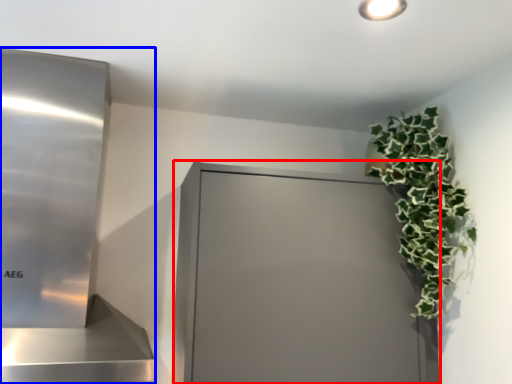
Question: Which point is closer to the camera, glass door (highlighted by a red box) or appliance (highlighted by a blue box)?

Choices:
 (A) glass door
 (B) appliance

Answer: (B)